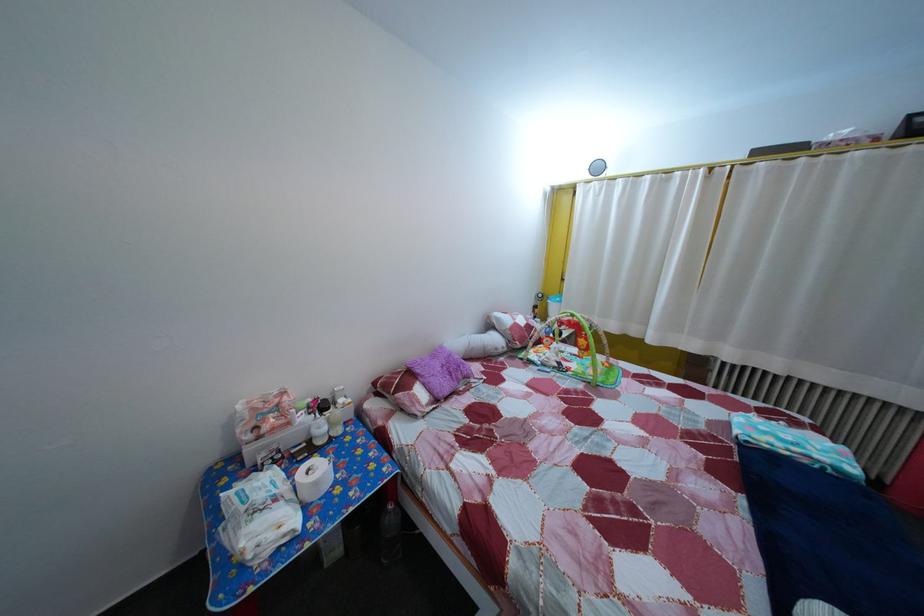
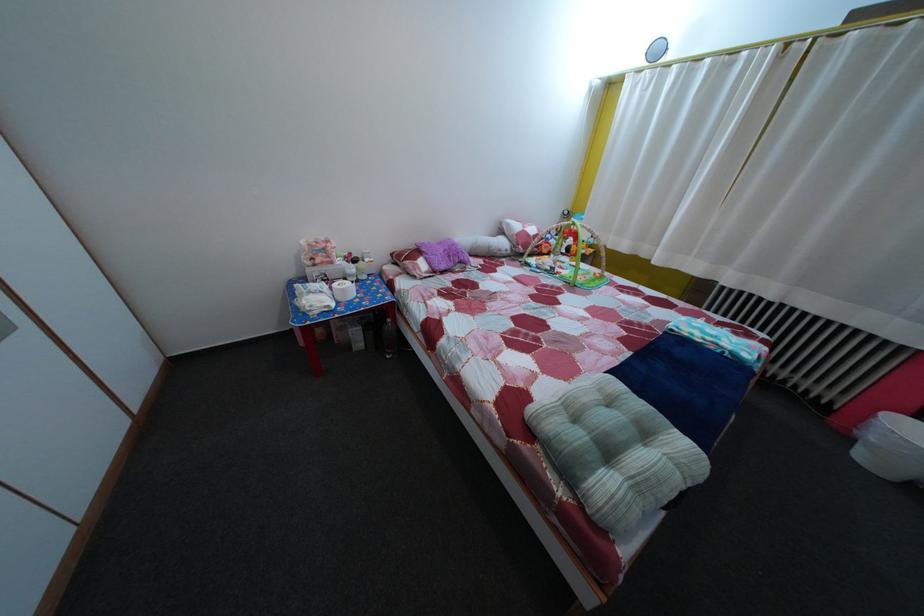
Which direction would the cameraman need to move to produce the second image?

The cameraman moved toward right, backward.